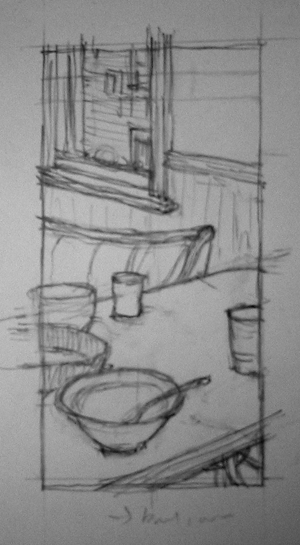
The width and height of the screenshot is (300, 545). Find the location of `cup`. cup is located at coordinates (134, 290), (250, 332).